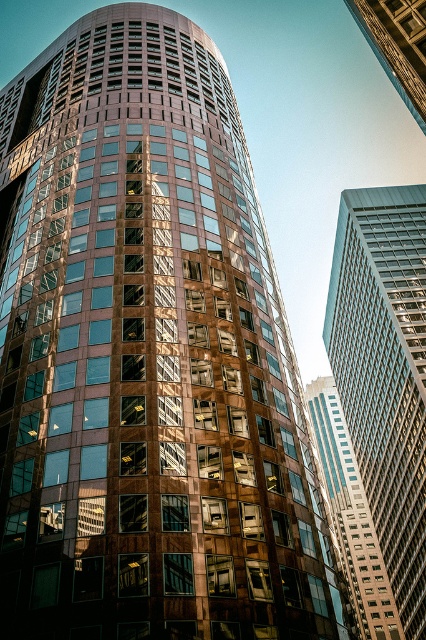
You are an architect evaluating the design of the modern building complex. You notice the glassy reflective skyscraper at right and the metallic glass skyscraper at upper right. Which of these two skyscrapers has a greater overall size?

The glassy reflective skyscraper at right is larger in size than the metallic glass skyscraper at upper right.